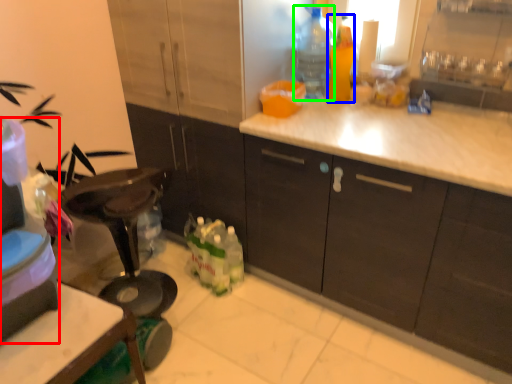
Question: Which object is positioned closest to appliance (highlighted by a red box)? Select from bottle (highlighted by a blue box) and bottle (highlighted by a green box).

Choices:
 (A) bottle
 (B) bottle

Answer: (B)